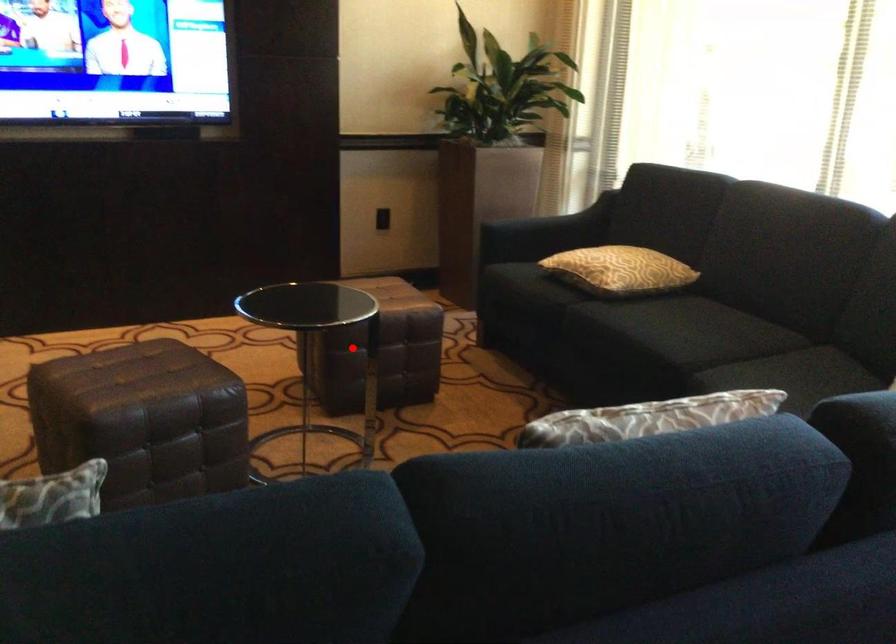
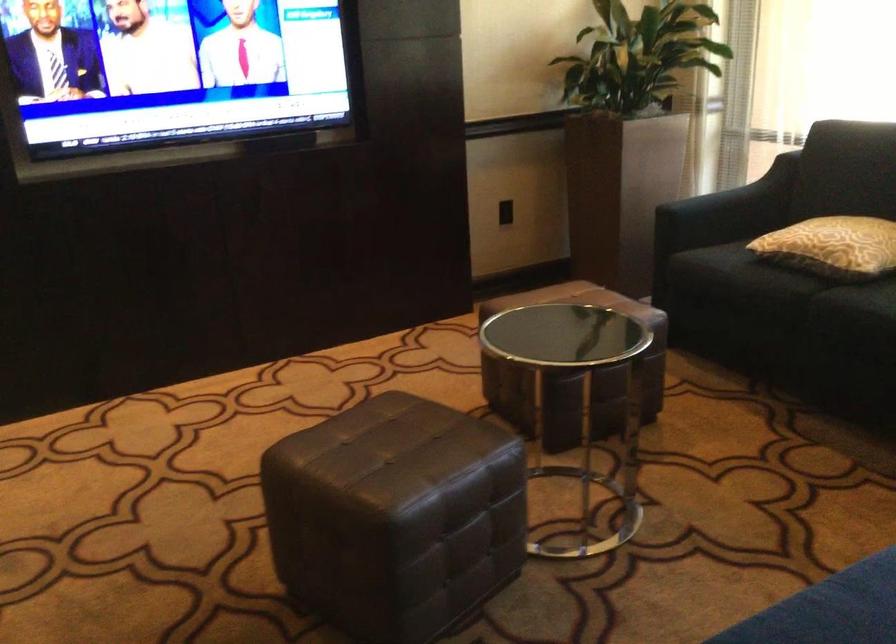
The point at the highlighted location is marked in the first image. Where is the corresponding point in the second image?

(573, 373)